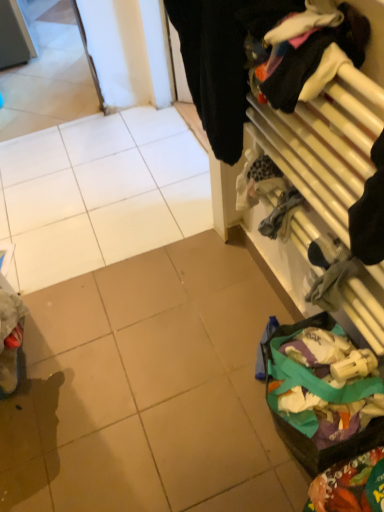
At what (x,y) coordinates should I click in order to perform the action: click on vacant area situated to the left side of multicolored fabric bag at lower right, the 2th waste from the front. Please return your answer as a coordinate pair (x, y). The image size is (384, 512). Looking at the image, I should click on (232, 434).